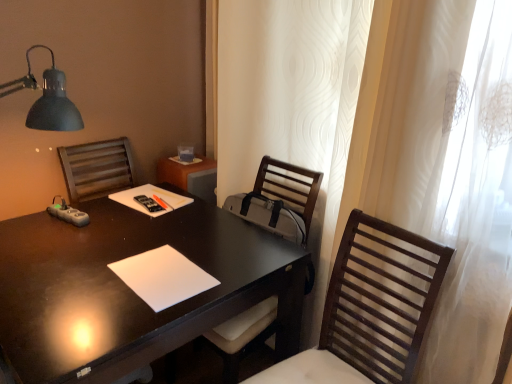
Locate an element on the screen. The image size is (512, 384). vacant space that is to the left of white matte notepad at center is located at coordinates (71, 273).